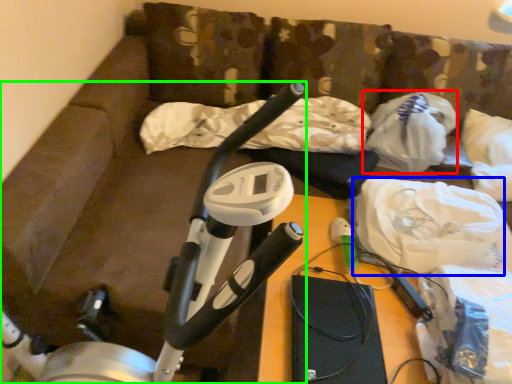
Question: Based on their relative distances, which object is farther from plastic bag (highlighted by a red box)? Choose from material (highlighted by a blue box) and stationary bicycle (highlighted by a green box).

Choices:
 (A) material
 (B) stationary bicycle

Answer: (B)